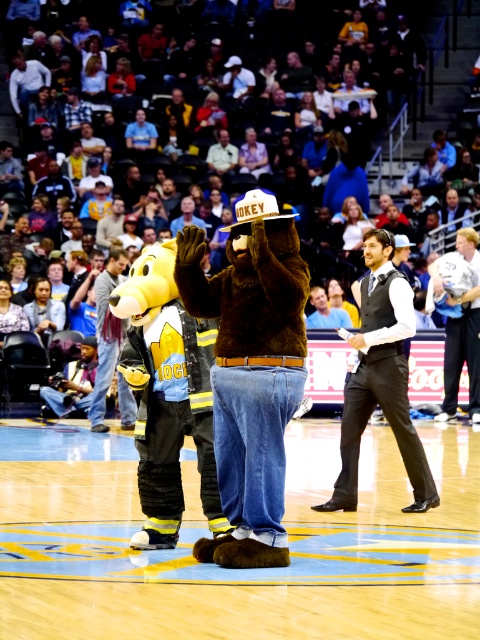
Question: Can you confirm if multicolored fabric seats at center is bigger than black satin vest at center?

Choices:
 (A) yes
 (B) no

Answer: (A)

Question: Which point is closer to the camera?

Choices:
 (A) black satin vest at center
 (B) wooden polished floor at center
 (C) denim jeans at center

Answer: (B)

Question: Estimate the real-world distances between objects in this image. Which object is closer to the brown fuzzy bear at center?

Choices:
 (A) wooden polished floor at center
 (B) multicolored fabric seats at center

Answer: (A)

Question: Does light blue fabric shirt at center have a larger size compared to denim jeans at center?

Choices:
 (A) no
 (B) yes

Answer: (B)

Question: Which object is farther from the camera taking this photo?

Choices:
 (A) light beige shirt at upper center
 (B) light blue fabric shirt at center
 (C) wooden polished floor at center
 (D) black satin vest at center

Answer: (A)

Question: Can you confirm if wooden polished floor at center is positioned to the right of light beige shirt at upper center?

Choices:
 (A) yes
 (B) no

Answer: (A)